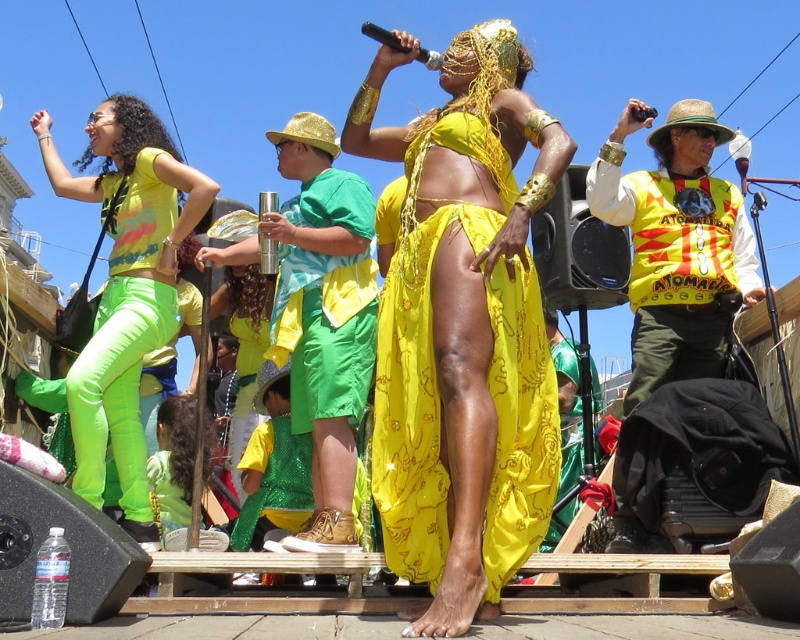
You are an audience member standing in front of the stage. You notice two fabrics in the center of the image, the shiny yellow fabric at center and the green fabric at center. Which fabric is positioned to the right side of the other?

The shiny yellow fabric at center is to the right of the green fabric at center.

You are an event planner organizing a photo shoot for the performers. You need to decide which performer to place in the foreground for a closeup shot. Which performer has a narrower width between the shiny yellow fabric at center and the neon green pants at left?

The shiny yellow fabric at center has a narrower width compared to the neon green pants at left, so the performer with the shiny yellow fabric at center should be placed in the foreground for the closeup shot.